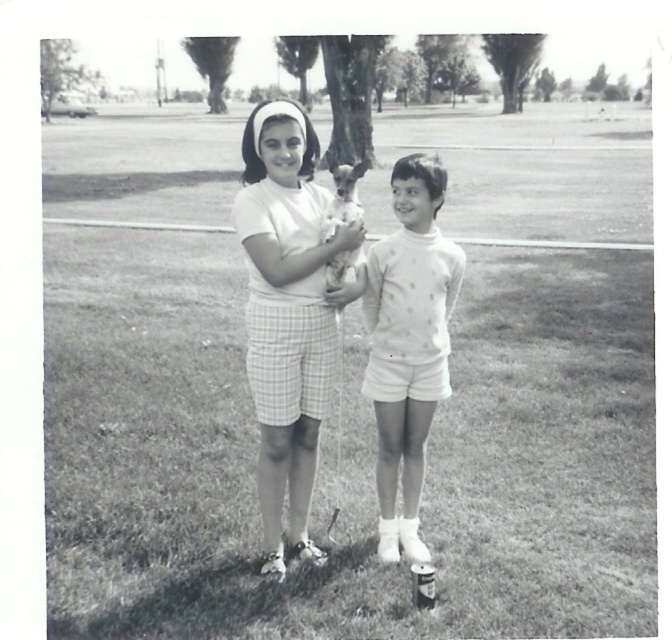
Looking at this image, is white plaid shorts at center shorter than white dotted sweater at center?

No, white plaid shorts at center is not shorter than white dotted sweater at center.

Can you confirm if white plaid shorts at center is bigger than white dotted sweater at center?

Indeed, white plaid shorts at center has a larger size compared to white dotted sweater at center.

Describe the element at coordinates (288, 316) in the screenshot. This screenshot has width=672, height=640. I see `white plaid shorts at center` at that location.

The image size is (672, 640). What are the coordinates of `white plaid shorts at center` in the screenshot? It's located at (288, 316).